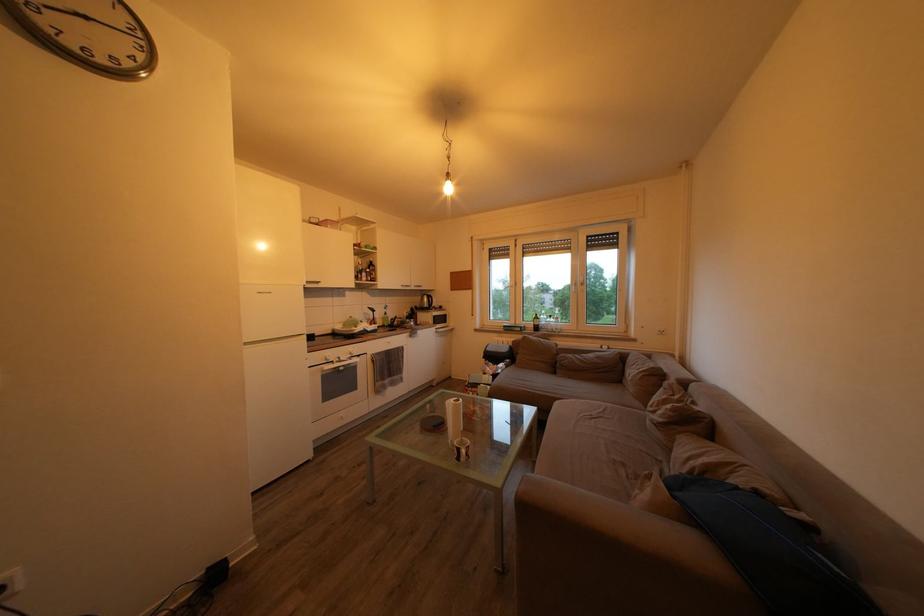
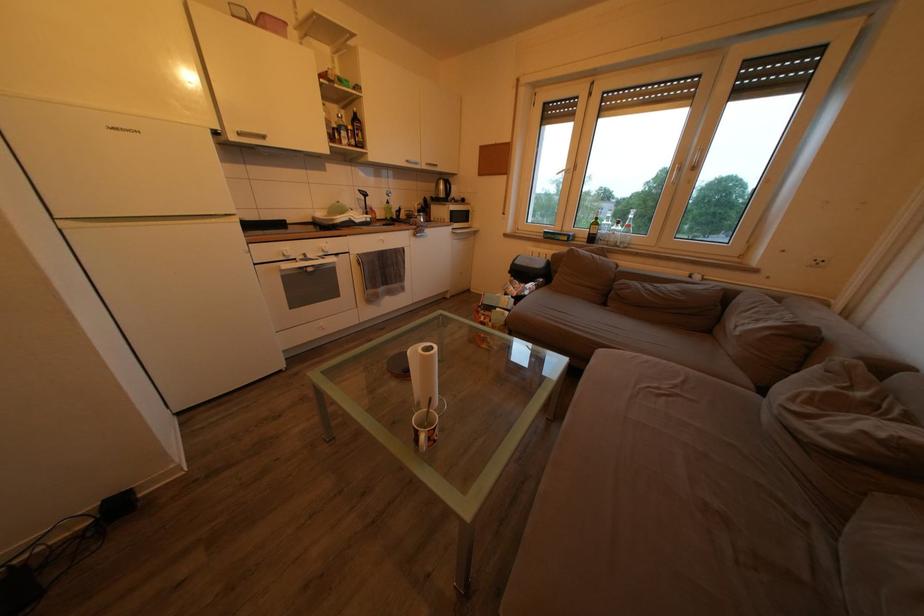
Question: The first image is from the beginning of the video and the second image is from the end. How did the camera likely rotate when shooting the video?

Choices:
 (A) Left
 (B) Right
 (C) Up
 (D) Down

Answer: (D)